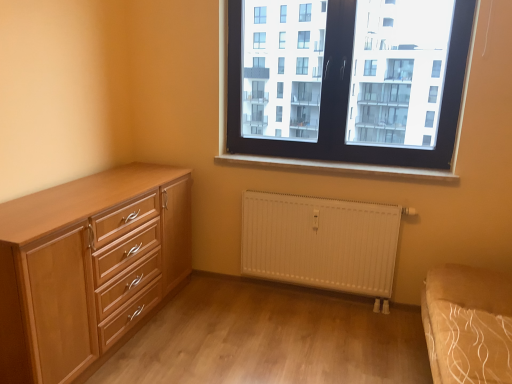
This screenshot has height=384, width=512. Find the location of `vacant region to the left of white matte radiator at lower center`. vacant region to the left of white matte radiator at lower center is located at coordinates (233, 312).